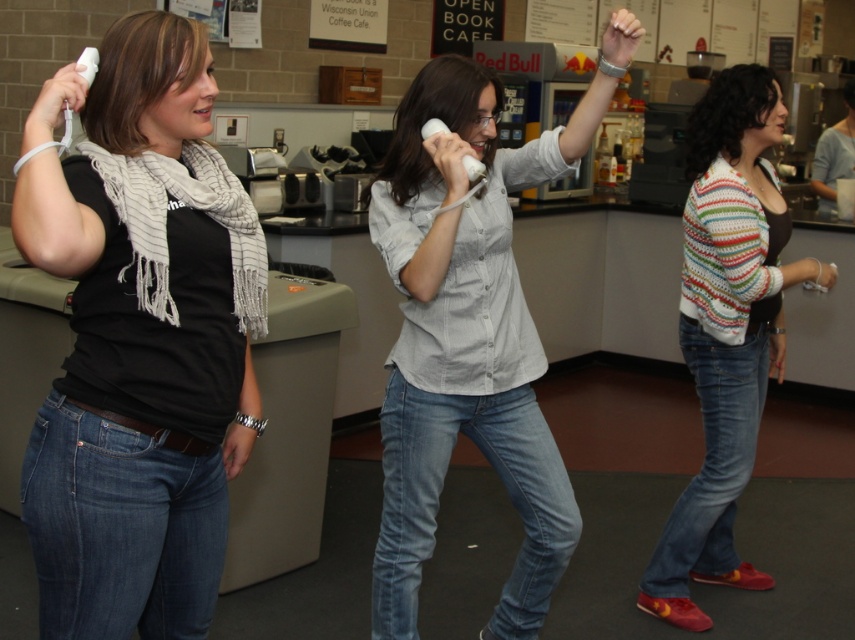
Between black matte scarf at left and striped knit sweater at right, which one appears on the right side from the viewer's perspective?

striped knit sweater at right is more to the right.

Is black matte scarf at left closer to camera compared to striped knit sweater at right?

Yes.

Describe the element at coordinates (139, 339) in the screenshot. The image size is (855, 640). I see `black matte scarf at left` at that location.

The image size is (855, 640). What are the coordinates of `black matte scarf at left` in the screenshot? It's located at (139, 339).

Can you confirm if denim jeans at center is taller than striped knit sweater at right?

No.

Is point (500, 218) positioned after point (724, 264)?

That is False.

Find the location of a particular element. denim jeans at center is located at coordinates (470, 332).

Can you confirm if black matte scarf at left is smaller than denim jeans at center?

Indeed, black matte scarf at left has a smaller size compared to denim jeans at center.

Can you confirm if black matte scarf at left is positioned to the right of denim jeans at center?

Incorrect, black matte scarf at left is not on the right side of denim jeans at center.

This screenshot has height=640, width=855. I want to click on black matte scarf at left, so click(x=139, y=339).